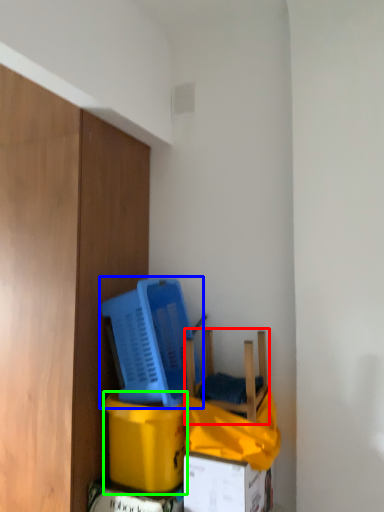
Question: Which is nearer to the chair (highlighted by a red box)? basket (highlighted by a blue box) or cardboard box (highlighted by a green box).

Choices:
 (A) basket
 (B) cardboard box

Answer: (A)